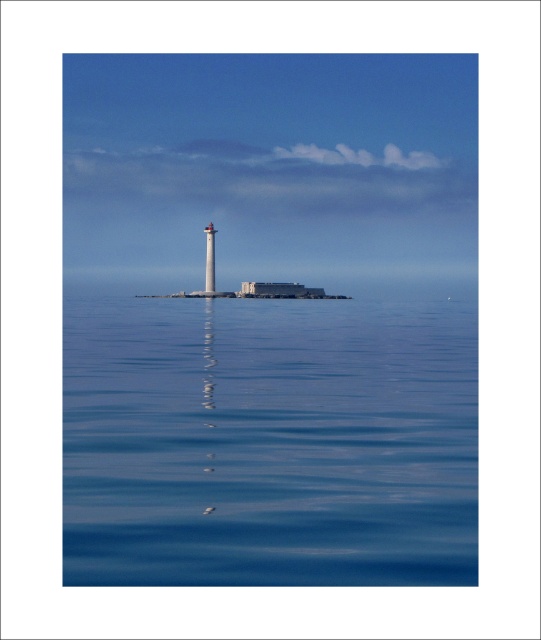
You are a photographer planning to capture the lighthouse and the water in one frame. Given that the white glossy lighthouse at center is smaller than the smooth blue water at center, which object should you focus on to ensure the lighthouse remains visible in the background while the water takes up most of the foreground?

The smooth blue water at center is larger in size compared to the white glossy lighthouse at center, so focusing on the smooth blue water at center will allow the lighthouse to remain visible in the background while the water occupies more of the foreground.

You are a seagull flying above the seascape. You see the smooth blue water at center and the white glossy lighthouse at center. Which object is closer to you as you fly?

The smooth blue water at center is in front of the white glossy lighthouse at center, so the smooth blue water at center is closer to you as you fly.

You are a drone operator flying a drone over the seascape. Your drone is currently at the point marked by point (268, 442). You want to fly it to the lighthouse. Which direction should you steer the drone to reach the lighthouse?

The point (268, 442) represents the smooth blue water at center. The lighthouse is positioned slightly off center towards the left side of the frame. Therefore, to reach the lighthouse, you should steer the drone to the left from the point (268, 442).